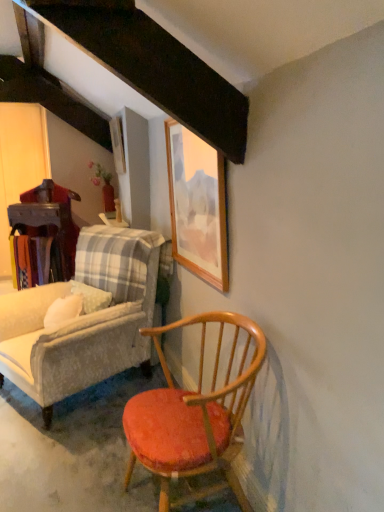
Question: Is wooden chair with cushion at lower left, placed as the second chair when sorted from front to back, facing towards wooden picture frame at upper center, arranged as the first picture frame when viewed from the top?

Choices:
 (A) no
 (B) yes

Answer: (A)

Question: Considering the relative sizes of wooden chair with cushion at lower left, the 1th chair in the left-to-right sequence, and wooden picture frame at upper center, positioned as the 2th picture frame in bottom-to-top order, in the image provided, is wooden chair with cushion at lower left, the 1th chair in the left-to-right sequence, bigger than wooden picture frame at upper center, positioned as the 2th picture frame in bottom-to-top order,?

Choices:
 (A) no
 (B) yes

Answer: (B)

Question: Does wooden chair with cushion at lower left, placed as the second chair when sorted from front to back, have a greater height compared to wooden picture frame at upper center, acting as the 2th picture frame starting from the front?

Choices:
 (A) no
 (B) yes

Answer: (B)

Question: From a real-world perspective, is wooden chair with cushion at lower left, the 1th chair in the left-to-right sequence, physically below wooden picture frame at upper center, marked as the first picture frame in a left-to-right arrangement?

Choices:
 (A) no
 (B) yes

Answer: (B)

Question: Is wooden chair with cushion at lower left, the first chair in the back-to-front sequence, further to camera compared to wooden picture frame at upper center, acting as the 2th picture frame starting from the front?

Choices:
 (A) no
 (B) yes

Answer: (A)

Question: Considering the relative positions of wooden chair with cushion at lower left, the second chair viewed from the right, and wooden picture frame at upper center, marked as the first picture frame in a left-to-right arrangement, in the image provided, is wooden chair with cushion at lower left, the second chair viewed from the right, to the right of wooden picture frame at upper center, marked as the first picture frame in a left-to-right arrangement, from the viewer's perspective?

Choices:
 (A) yes
 (B) no

Answer: (B)

Question: Would you say wooden table at left is part of wooden chair with orange cushion at lower right, arranged as the first chair when viewed from the front,'s contents?

Choices:
 (A) no
 (B) yes

Answer: (A)

Question: Is wooden chair with orange cushion at lower right, arranged as the first chair when viewed from the right, thinner than wooden table at left?

Choices:
 (A) no
 (B) yes

Answer: (A)

Question: Is the surface of wooden chair with orange cushion at lower right, arranged as the first chair when viewed from the right, in direct contact with wooden table at left?

Choices:
 (A) no
 (B) yes

Answer: (A)

Question: From a real-world perspective, does wooden chair with orange cushion at lower right, the second chair from the back, stand above wooden table at left?

Choices:
 (A) no
 (B) yes

Answer: (A)

Question: From the image's perspective, would you say wooden chair with orange cushion at lower right, the second chair from the back, is shown under wooden table at left?

Choices:
 (A) yes
 (B) no

Answer: (A)

Question: Is wooden chair with orange cushion at lower right, arranged as the first chair when viewed from the right, oriented towards wooden table at left?

Choices:
 (A) yes
 (B) no

Answer: (B)

Question: Is wooden table at left facing away from wooden chair with orange cushion at lower right, the second chair positioned from the left?

Choices:
 (A) yes
 (B) no

Answer: (B)